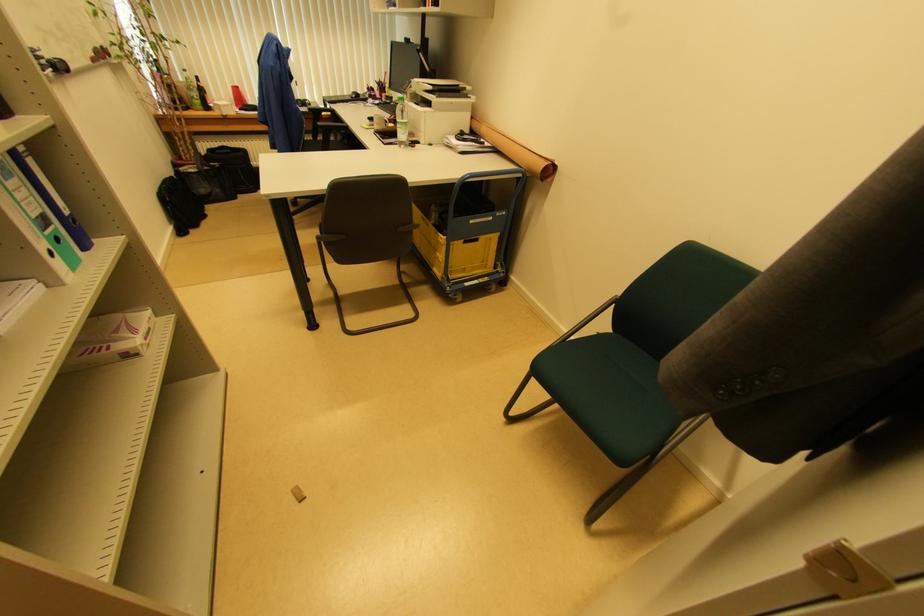
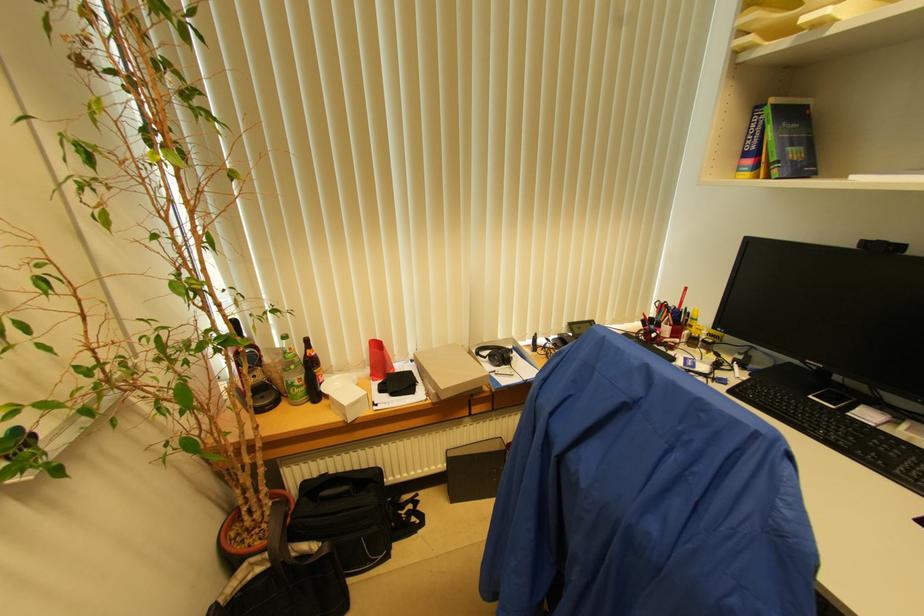
Locate, in the second image, the point that corresponds to (x=408, y=44) in the first image.

(882, 251)